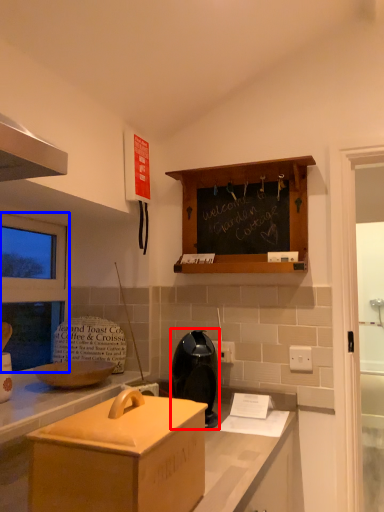
Question: Which object is closer to the camera taking this photo, appliance (highlighted by a red box) or window screen (highlighted by a blue box)?

Choices:
 (A) appliance
 (B) window screen

Answer: (A)